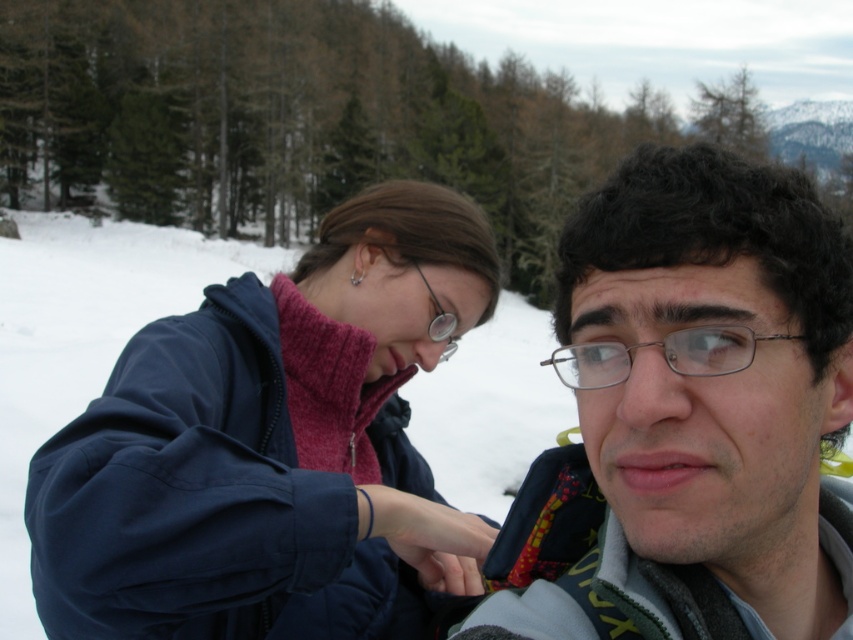
You are a photographer trying to capture a clear shot of both the matte black glasses at center and the matte metal glasses at upper center. However, you notice that one is blocking the view of the other. Which glasses are currently obscuring the other?

The matte black glasses at center is in front of matte metal glasses at upper center, so it is blocking the view of the matte metal glasses at upper center.

You are standing in the snowy landscape and want to determine which of the two points, point (741, 396) or point (723, 360), is closer to you. Based on the image, which point is nearer?

Point (741, 396) is closer to you because it is further to the viewer than point (723, 360).